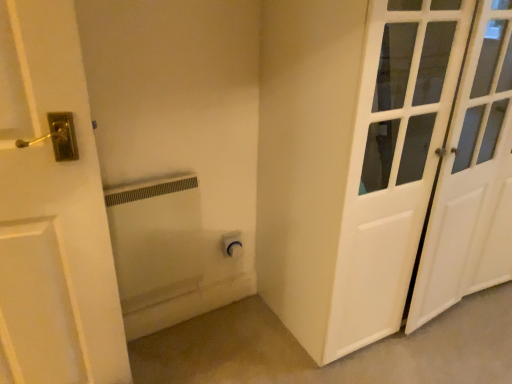
Question: Can you confirm if white matte radiator at center is taller than white glossy door at right?

Choices:
 (A) yes
 (B) no

Answer: (B)

Question: From a real-world perspective, is white matte radiator at center positioned under white glossy door at right based on gravity?

Choices:
 (A) yes
 (B) no

Answer: (A)

Question: Does white matte radiator at center have a larger size compared to white glossy door at right?

Choices:
 (A) no
 (B) yes

Answer: (A)

Question: From the image's perspective, is white matte radiator at center beneath white glossy door at right?

Choices:
 (A) yes
 (B) no

Answer: (A)

Question: From the image's perspective, would you say white matte radiator at center is positioned over white glossy door at right?

Choices:
 (A) no
 (B) yes

Answer: (A)

Question: In the image, is white matte radiator at center positioned in front of or behind white matte outlet at lower center?

Choices:
 (A) front
 (B) behind

Answer: (B)

Question: Based on their sizes in the image, would you say white matte radiator at center is bigger or smaller than white matte outlet at lower center?

Choices:
 (A) big
 (B) small

Answer: (B)

Question: From a real-world perspective, is white matte radiator at center physically located above or below white matte outlet at lower center?

Choices:
 (A) below
 (B) above

Answer: (B)

Question: Is point (187, 276) closer or farther from the camera than point (314, 377)?

Choices:
 (A) farther
 (B) closer

Answer: (A)

Question: Is white matte outlet at lower center taller or shorter than white glossy door at right?

Choices:
 (A) tall
 (B) short

Answer: (B)

Question: Is white matte outlet at lower center to the left or to the right of white glossy door at right in the image?

Choices:
 (A) left
 (B) right

Answer: (A)

Question: From a real-world perspective, is white matte outlet at lower center above or below white glossy door at right?

Choices:
 (A) below
 (B) above

Answer: (A)

Question: Do you think white matte outlet at lower center is within white glossy door at right, or outside of it?

Choices:
 (A) inside
 (B) outside

Answer: (B)

Question: From the image's perspective, is white matte outlet at lower center located above or below white matte radiator at center?

Choices:
 (A) above
 (B) below

Answer: (B)

Question: Is white matte outlet at lower center to the left or to the right of white matte radiator at center in the image?

Choices:
 (A) left
 (B) right

Answer: (B)